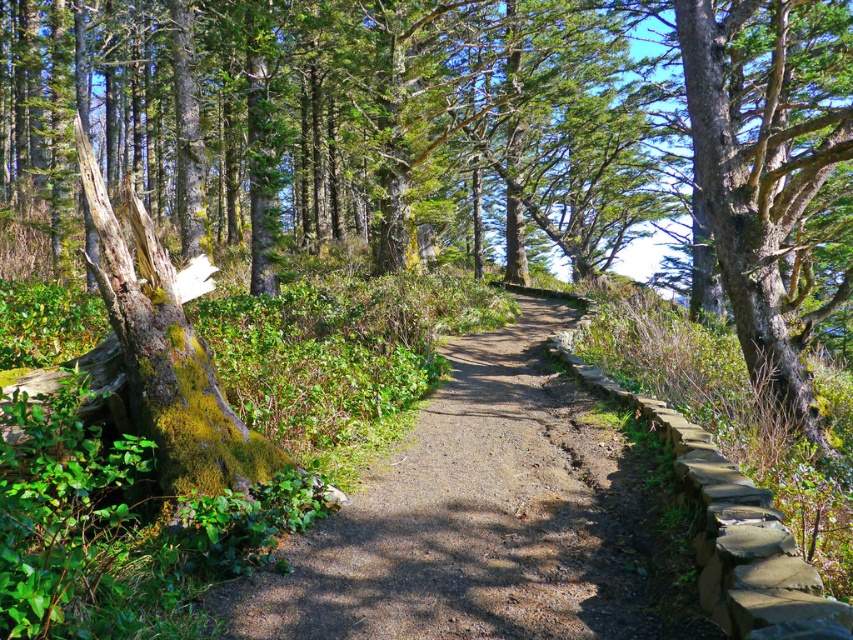
Is dirt path at center smaller than green mossy bark tree at center?

Yes.

Which is more to the right, dirt path at center or green mossy bark tree at center?

green mossy bark tree at center

Measure the distance between point [515,604] and camera.

The distance of point [515,604] from camera is 3.89 meters.

This screenshot has width=853, height=640. Identify the location of dirt path at center. tap(490, 518).